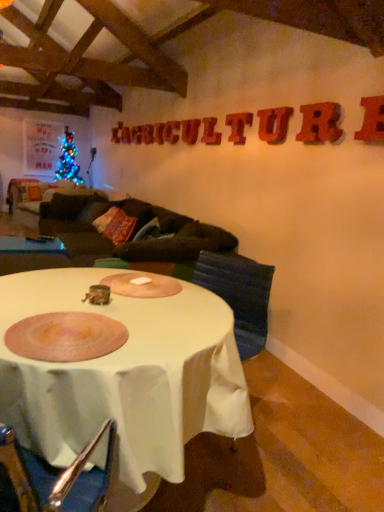
Question: Could you tell me if wooden textured letter at upper center, the 4th letter in the back-to-front sequence, is facing matte red letter at upper center, the 5th letter viewed from the front?

Choices:
 (A) yes
 (B) no

Answer: (B)

Question: Is wooden textured letter at upper center, the 4th letter in the back-to-front sequence, further to camera compared to matte red letter at upper center, placed as the fifth letter when sorted from back to front?

Choices:
 (A) yes
 (B) no

Answer: (A)

Question: From the image's perspective, would you say wooden textured letter at upper center, which is counted as the fourth letter, starting from the left, is shown under matte red letter at upper center, which ranks as the 5th letter in left-to-right order?

Choices:
 (A) no
 (B) yes

Answer: (A)

Question: Would you say wooden textured letter at upper center, which is counted as the fourth letter, starting from the left, is a long distance from matte red letter at upper center, which ranks as the 5th letter in left-to-right order?

Choices:
 (A) yes
 (B) no

Answer: (B)

Question: Considering the relative sizes of wooden textured letter at upper center, the 4th letter in the back-to-front sequence, and matte red letter at upper center, which ranks as the 5th letter in left-to-right order, in the image provided, is wooden textured letter at upper center, the 4th letter in the back-to-front sequence, bigger than matte red letter at upper center, which ranks as the 5th letter in left-to-right order,?

Choices:
 (A) no
 (B) yes

Answer: (A)

Question: Is wooden textured letter at upper center, which is counted as the fourth letter, starting from the left, at the right side of matte red letter at upper center, which is the fifth letter in right-to-left order?

Choices:
 (A) yes
 (B) no

Answer: (B)

Question: Considering the relative sizes of white cloth-covered table at center, placed as the first table when sorted from front to back, and rubberized red letter at upper right, placed as the 9th letter when sorted from left to right, in the image provided, is white cloth-covered table at center, placed as the first table when sorted from front to back, bigger than rubberized red letter at upper right, placed as the 9th letter when sorted from left to right,?

Choices:
 (A) yes
 (B) no

Answer: (A)

Question: Is white cloth-covered table at center, placed as the 1th table when sorted from bottom to top, oriented towards rubberized red letter at upper right, which is the first letter in right-to-left order?

Choices:
 (A) yes
 (B) no

Answer: (B)

Question: Considering the relative sizes of white cloth-covered table at center, placed as the second table when sorted from back to front, and rubberized red letter at upper right, the ninth letter positioned from the back, in the image provided, is white cloth-covered table at center, placed as the second table when sorted from back to front, thinner than rubberized red letter at upper right, the ninth letter positioned from the back,?

Choices:
 (A) no
 (B) yes

Answer: (A)

Question: Does white cloth-covered table at center, placed as the second table when sorted from back to front, appear on the left side of rubberized red letter at upper right, the ninth letter positioned from the back?

Choices:
 (A) no
 (B) yes

Answer: (B)

Question: Is white cloth-covered table at center, which ranks as the 2th table in left-to-right order, positioned in front of rubberized red letter at upper right, which is the first letter in right-to-left order?

Choices:
 (A) yes
 (B) no

Answer: (A)

Question: Considering the relative sizes of white cloth-covered table at center, placed as the second table when sorted from back to front, and rubberized red letter at upper right, arranged as the 1th letter when viewed from the front, in the image provided, is white cloth-covered table at center, placed as the second table when sorted from back to front, wider than rubberized red letter at upper right, arranged as the 1th letter when viewed from the front,?

Choices:
 (A) no
 (B) yes

Answer: (B)

Question: Does matte red letter at upper center, which is the 2th letter in left-to-right order, have a lesser height compared to white cloth-covered table at center, which ranks as the 2th table in left-to-right order?

Choices:
 (A) yes
 (B) no

Answer: (A)